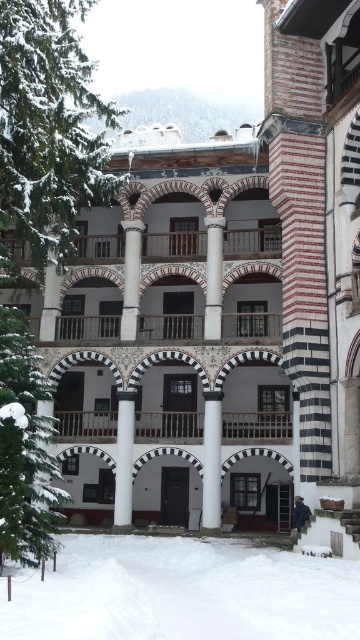
Question: Which of the following is the farthest from the observer?

Choices:
 (A) white glossy column at center
 (B) white powdery snow at lower center
 (C) white stone column at center
 (D) white marble column at center

Answer: (D)

Question: Which point is closer to the camera?

Choices:
 (A) click(270, 593)
 (B) click(132, 264)
 (C) click(206, 228)
 (D) click(127, 435)

Answer: (A)

Question: Which object appears closest to the camera in this image?

Choices:
 (A) white smooth column at center
 (B) white stone column at center
 (C) white powdery snow at lower center

Answer: (C)

Question: Can you confirm if white glossy column at center is wider than white marble column at center?

Choices:
 (A) no
 (B) yes

Answer: (A)

Question: Is white smooth column at center to the left of white glossy column at center from the viewer's perspective?

Choices:
 (A) no
 (B) yes

Answer: (A)

Question: Can you confirm if white powdery snow at lower center is bigger than white marble column at center?

Choices:
 (A) no
 (B) yes

Answer: (B)